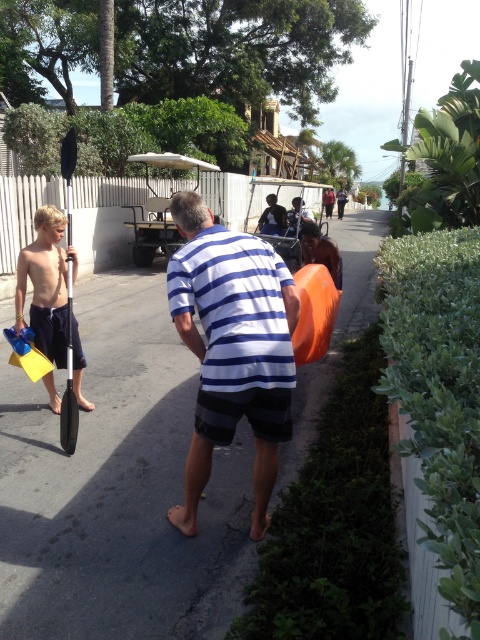
You are standing at the starting point and want to reach the yellow matte flippers at left first before picking up the white striped shirt at center. Given that you can move in a straight line, which object should you head towards first?

The white striped shirt at center is 6.09 feet away from the yellow matte flippers at left. Therefore, to reach the yellow matte flippers at left first, you should head directly towards the yellow matte flippers at left since it is closer to your starting position than the white striped shirt at center.

You are standing at the point labeled point (119, 486). Looking around, what surface are you standing on?

You are standing on the gray asphalt pavement at center.

You are standing at point A, which is at coordinate point(259, 260), and want to walk to point B, which is at coordinate point(47, 275). Given that point A is closer to the camera than point B, which direction should you face to move towards point B?

Since point A is closer to the camera than point B, you should face away from the camera to move towards point B.